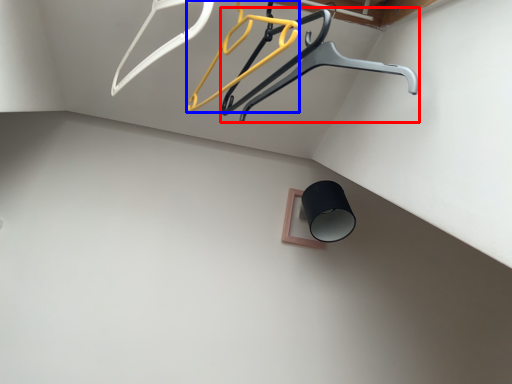
Question: Which object appears farthest to the camera in this image, furniture (highlighted by a red box) or hanger (highlighted by a blue box)?

Choices:
 (A) furniture
 (B) hanger

Answer: (A)